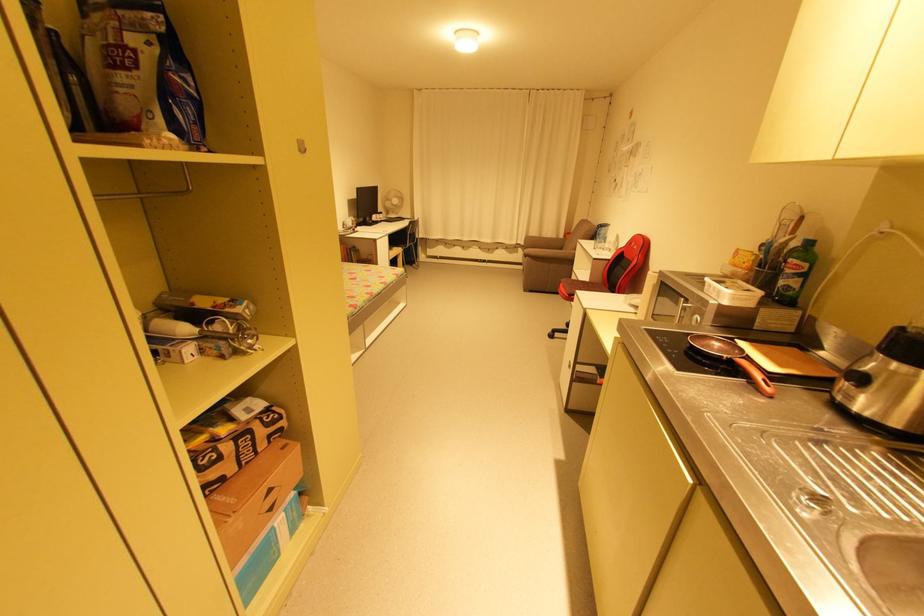
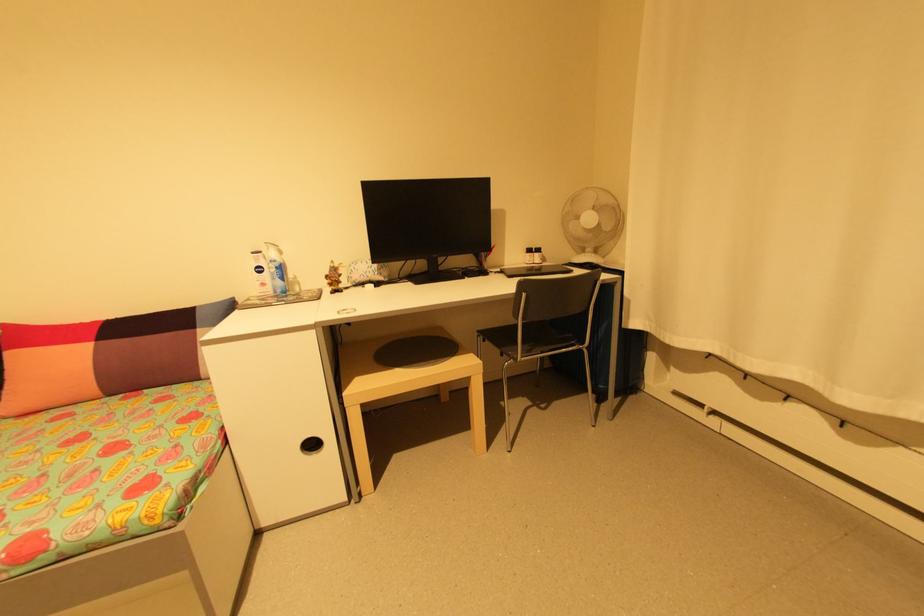
The point at [476,249] is marked in the first image. Where is the corresponding point in the second image?

(906, 448)